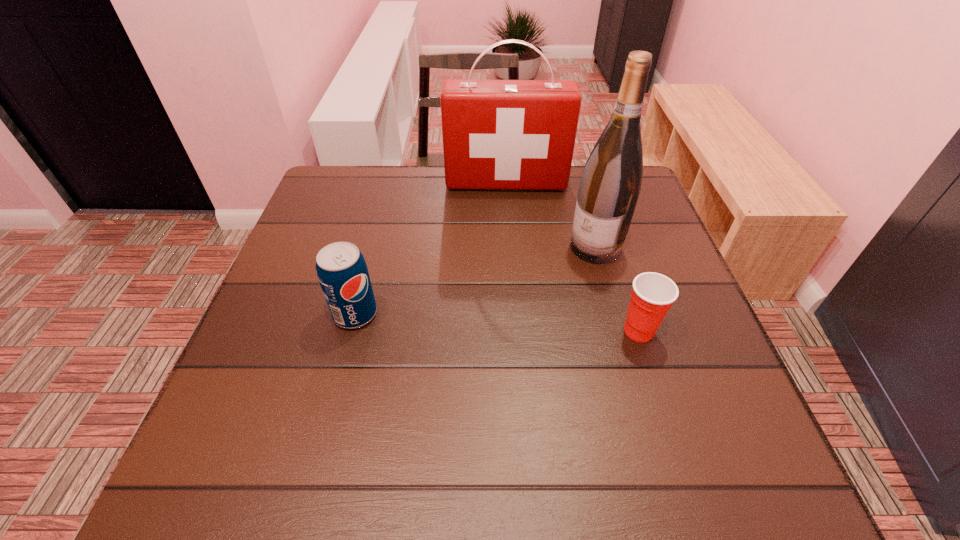
Where is `pop`? The image size is (960, 540). pop is located at coordinates (342, 272).

Locate an element on the screen. The height and width of the screenshot is (540, 960). the leftmost object is located at coordinates (342, 272).

Find the location of a particular element. This screenshot has width=960, height=540. Dixie cup is located at coordinates (653, 294).

The image size is (960, 540). What are the coordinates of `wine bottle` in the screenshot? It's located at (610, 185).

You are a GUI agent. You are given a task and a screenshot of the screen. Output one action in this format:
    pyautogui.click(x=<x>, y=<y>)
    Task: Click on the third shortest object
    The image size is (960, 540).
    Given the screenshot: What is the action you would take?
    pyautogui.click(x=497, y=134)

This screenshot has width=960, height=540. Find the location of `the farthest object`. the farthest object is located at coordinates (497, 134).

This screenshot has height=540, width=960. In order to click on vacant space located on the front of the pop in this screenshot , I will do `click(327, 420)`.

Where is `vacant area situated on the front of the Dixie cup`? The image size is (960, 540). vacant area situated on the front of the Dixie cup is located at coordinates (651, 369).

Locate an element on the screen. This screenshot has width=960, height=540. vacant space located on the label of the wine bottle is located at coordinates (532, 298).

Locate an element on the screen. free space located 0.350m on the label of the wine bottle is located at coordinates (471, 346).